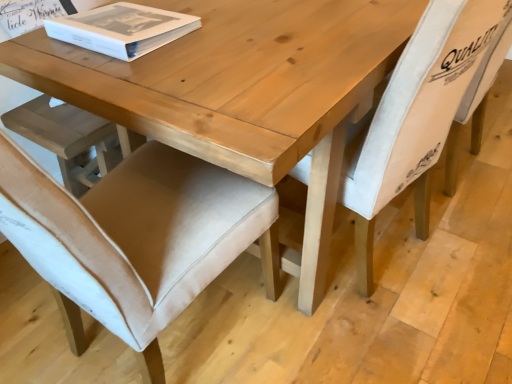
Locate an element on the screen. free space in front of white paper book at upper left is located at coordinates (127, 66).